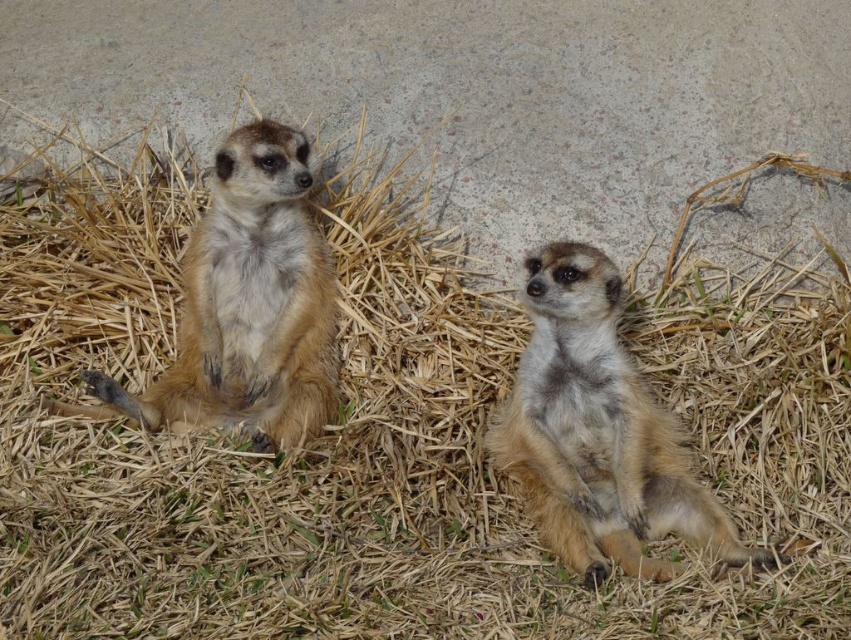
You are a wildlife photographer aiming to capture a closeup shot of the meerkats. You want to focus on the fuzzy brown meerkat at center without the golden fur meerkat at left being in the background. Is the current arrangement suitable for this?

The fuzzy brown meerkat at center is in front of the golden fur meerkat at left, so the golden fur meerkat at left would be behind the fuzzy brown meerkat at center. This arrangement allows you to focus on the fuzzy brown meerkat at center with the golden fur meerkat at left in the background, making it suitable for your closeup shot.

Consider the image. You are a wildlife photographer trying to capture a closeup shot of the meerkats. You have a camera lens that can focus on subjects up to 1 meter tall. Based on the scene, will both the fuzzy brown meerkat at center and the golden fur meerkat at left be in focus?

The fuzzy brown meerkat at center is not as tall as golden fur meerkat at left. Since the camera lens can focus up to 1 meter, both meerkats will be in focus as their heights are within the limit.

You are observing two meerkats in a dry grass area. The meerkats are the fuzzy brown meerkat at center and the golden fur meerkat at left. Which meerkat is positioned to the right of the other?

The fuzzy brown meerkat at center is positioned to the right of the golden fur meerkat at left.